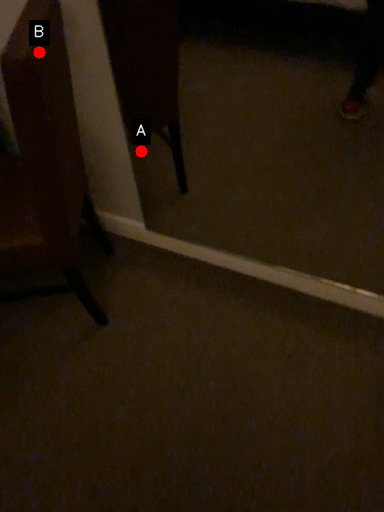
Question: Two points are circled on the image, labeled by A and B beside each circle. Which point is closer to the camera?

Choices:
 (A) A is closer
 (B) B is closer

Answer: (B)